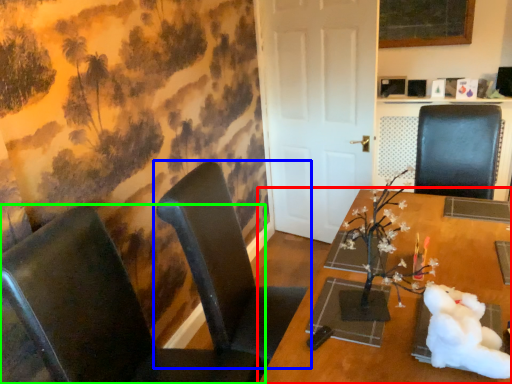
Question: Which is nearer to the table (highlighted by a red box)? chair (highlighted by a blue box) or chair (highlighted by a green box).

Choices:
 (A) chair
 (B) chair

Answer: (A)